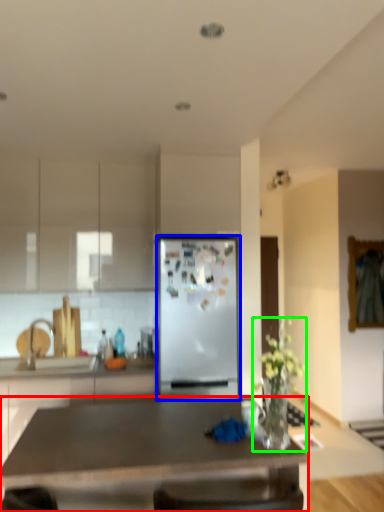
Question: Based on their relative distances, which object is nearer to desk (highlighted by a red box)? Choose from refrigerator (highlighted by a blue box) and houseplant (highlighted by a green box).

Choices:
 (A) refrigerator
 (B) houseplant

Answer: (B)